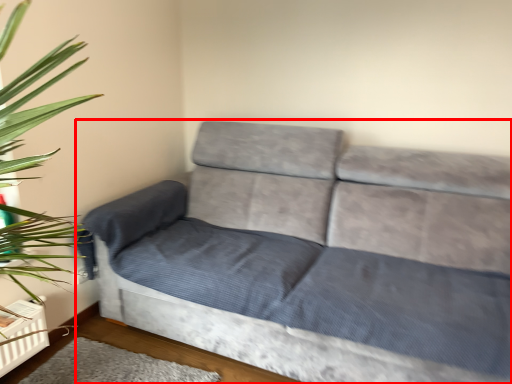
Question: From the image, what is the correct spatial relationship of studio couch (annotated by the red box) in relation to mat?

Choices:
 (A) right
 (B) left

Answer: (A)